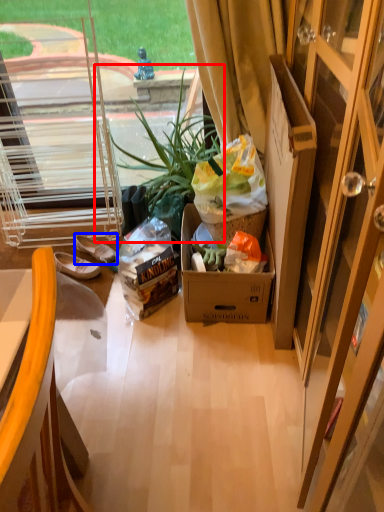
Question: Which point is further to the camera, houseplant (highlighted by a red box) or footwear (highlighted by a blue box)?

Choices:
 (A) houseplant
 (B) footwear

Answer: (B)